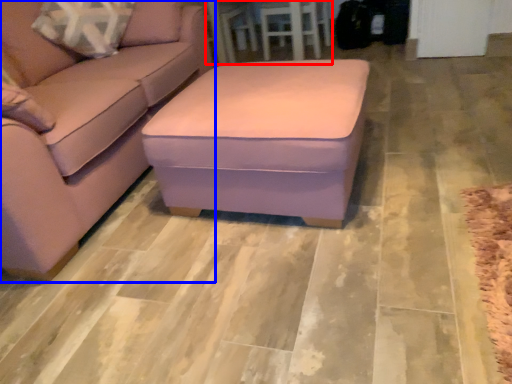
Question: Which object appears closest to the camera in this image, table (highlighted by a red box) or studio couch (highlighted by a blue box)?

Choices:
 (A) table
 (B) studio couch

Answer: (B)